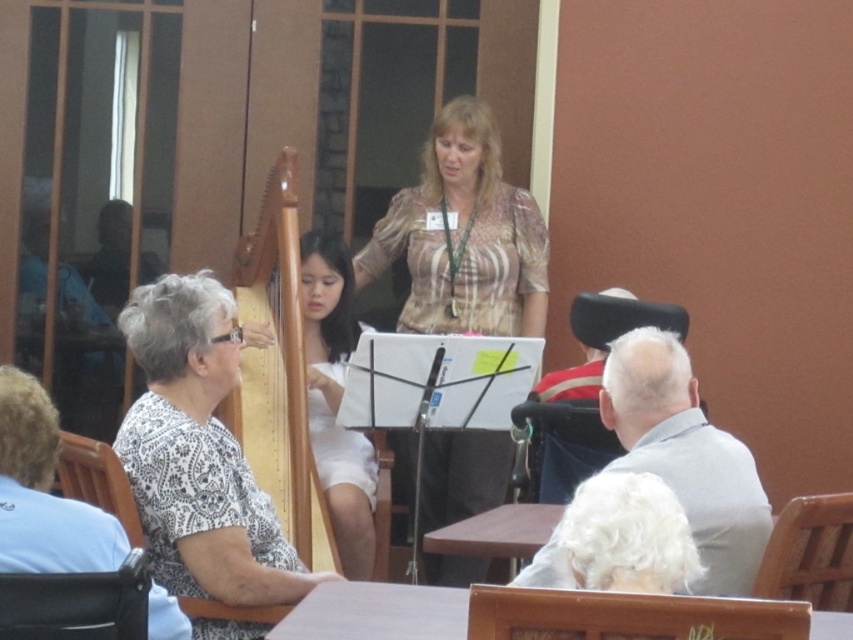
What is the 2D coordinate of the white dotted shirt at left in the image?

The white dotted shirt at left is located at the 2D coordinate point of [198,452].

You are an event planner looking at this image of a musical performance. You need to determine the spatial arrangement of the two performers wearing the patterned fabric blouse at center and the white fabric dress at center. Which one is positioned higher up in the image?

The patterned fabric blouse at center is located above the white fabric dress at center, so the performer wearing the patterned fabric blouse at center is positioned higher up in the image.